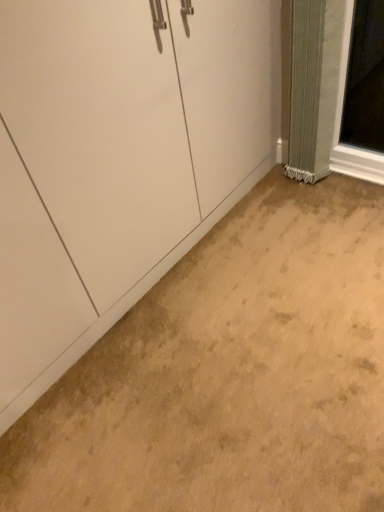
The height and width of the screenshot is (512, 384). What do you see at coordinates (314, 85) in the screenshot?
I see `green textured curtain at right` at bounding box center [314, 85].

The image size is (384, 512). Identify the location of green textured curtain at right. (314, 85).

At what (x,y) coordinates should I click in order to perform the action: click on beige carpet at lower center. Please return your answer as a coordinate pair (x, y). The height and width of the screenshot is (512, 384). Looking at the image, I should click on (230, 373).

What do you see at coordinates (230, 373) in the screenshot?
I see `beige carpet at lower center` at bounding box center [230, 373].

Identify the location of green textured curtain at right. (314, 85).

Considering the relative positions of green textured curtain at right and beige carpet at lower center in the image provided, is green textured curtain at right to the left of beige carpet at lower center from the viewer's perspective?

Incorrect, green textured curtain at right is not on the left side of beige carpet at lower center.

Does green textured curtain at right lie in front of beige carpet at lower center?

That is False.

Considering the positions of point (326, 75) and point (252, 360), is point (326, 75) closer or farther from the camera than point (252, 360)?

Clearly, point (326, 75) is more distant from the camera than point (252, 360).

From the image's perspective, which one is positioned higher, green textured curtain at right or beige carpet at lower center?

green textured curtain at right.

From a real-world perspective, is green textured curtain at right above or below beige carpet at lower center?

green textured curtain at right is above beige carpet at lower center.

Can you confirm if green textured curtain at right is wider than beige carpet at lower center?

No, green textured curtain at right is not wider than beige carpet at lower center.

Which of these two, green textured curtain at right or beige carpet at lower center, stands shorter?

beige carpet at lower center is shorter.

Looking at the image, does green textured curtain at right seem bigger or smaller compared to beige carpet at lower center?

green textured curtain at right is smaller than beige carpet at lower center.

Is green textured curtain at right inside the boundaries of beige carpet at lower center, or outside?

green textured curtain at right lies outside beige carpet at lower center.

Would you consider green textured curtain at right to be distant from beige carpet at lower center?

No, green textured curtain at right is in close proximity to beige carpet at lower center.

Is green textured curtain at right positioned with its back to beige carpet at lower center?

That's not correct — green textured curtain at right is not looking away from beige carpet at lower center.

How distant is green textured curtain at right from beige carpet at lower center?

green textured curtain at right is 92.02 centimeters away from beige carpet at lower center.

Where is `concrete that is on the left side of green textured curtain at right`? concrete that is on the left side of green textured curtain at right is located at coordinates (230, 373).

Is beige carpet at lower center to the left of green textured curtain at right from the viewer's perspective?

Correct, you'll find beige carpet at lower center to the left of green textured curtain at right.

In the scene shown: Which object is further away from the camera, beige carpet at lower center or green textured curtain at right?

green textured curtain at right is behind.

Between point (253, 492) and point (341, 42), which one is positioned behind?

Positioned behind is point (341, 42).

From the image's perspective, is beige carpet at lower center under green textured curtain at right?

Yes.

From a real-world perspective, which object rests below the other?

From a 3D spatial view, beige carpet at lower center is below.

Does beige carpet at lower center have a greater width compared to green textured curtain at right?

Yes, beige carpet at lower center is wider than green textured curtain at right.

Can you confirm if beige carpet at lower center is taller than green textured curtain at right?

No.

Which of these two, beige carpet at lower center or green textured curtain at right, is smaller?

With smaller size is green textured curtain at right.

Would you say beige carpet at lower center is outside green textured curtain at right?

Yes.

Is beige carpet at lower center positioned far away from green textured curtain at right?

They are positioned close to each other.

Is beige carpet at lower center aimed at green textured curtain at right?

No, beige carpet at lower center is not aimed at green textured curtain at right.

How different are the orientations of beige carpet at lower center and green textured curtain at right in degrees?

beige carpet at lower center and green textured curtain at right are facing 89.9 degrees away from each other.

Locate an element on the screen. Image resolution: width=384 pixels, height=512 pixels. concrete lying in front of the green textured curtain at right is located at coordinates (230, 373).

The width and height of the screenshot is (384, 512). I want to click on curtain behind the beige carpet at lower center, so click(x=314, y=85).

You are a GUI agent. You are given a task and a screenshot of the screen. Output one action in this format:
    pyautogui.click(x=<x>, y=<y>)
    Task: Click on the curtain that appears on the right of beige carpet at lower center
    This screenshot has height=512, width=384.
    Given the screenshot: What is the action you would take?
    pos(314,85)